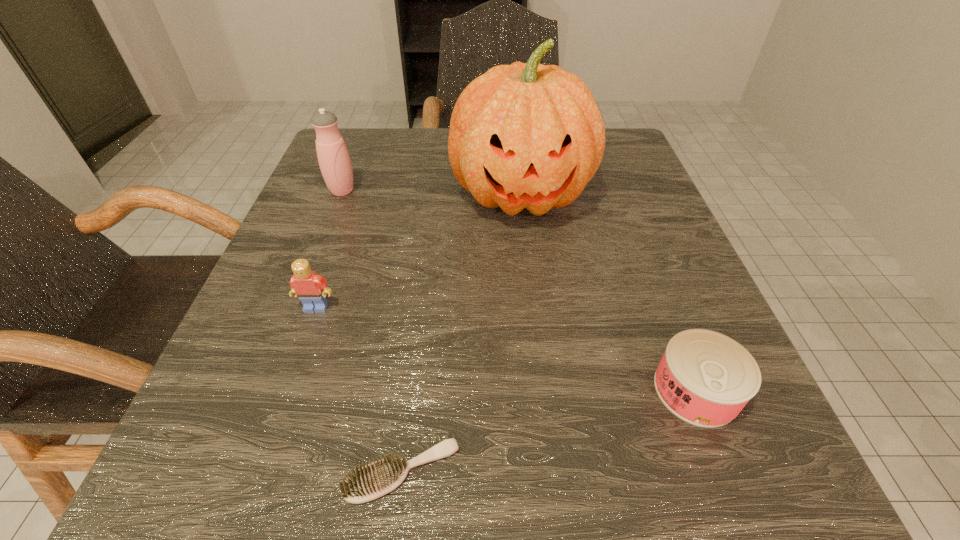
Find the location of `object that is at the far left corner`. object that is at the far left corner is located at coordinates (333, 157).

Find the location of `object at the far right corner`. object at the far right corner is located at coordinates (526, 135).

In the image, there is a desktop. Identify the location of vacant space at the near edge. The width and height of the screenshot is (960, 540). (334, 473).

Image resolution: width=960 pixels, height=540 pixels. Identify the location of vacant space at the left edge of the desktop. (286, 373).

Find the location of a particular element. The width and height of the screenshot is (960, 540). vacant space at the right edge is located at coordinates (660, 222).

Identify the location of vacant space at the far left corner. The height and width of the screenshot is (540, 960). (345, 132).

In the image, there is a desktop. At what (x,y) coordinates should I click in order to perform the action: click on vacant space at the near left corner. Please return your answer as a coordinate pair (x, y). Looking at the image, I should click on (291, 472).

This screenshot has height=540, width=960. I want to click on blank space at the far right corner of the desktop, so [x=622, y=163].

You are a GUI agent. You are given a task and a screenshot of the screen. Output one action in this format:
    pyautogui.click(x=<x>, y=<y>)
    Task: Click on the free spot between the thermos bottle and the second nearest object
    
    Given the screenshot: What is the action you would take?
    pyautogui.click(x=519, y=290)

Identify the location of unoccupied area between the Lego and the can. (506, 348).